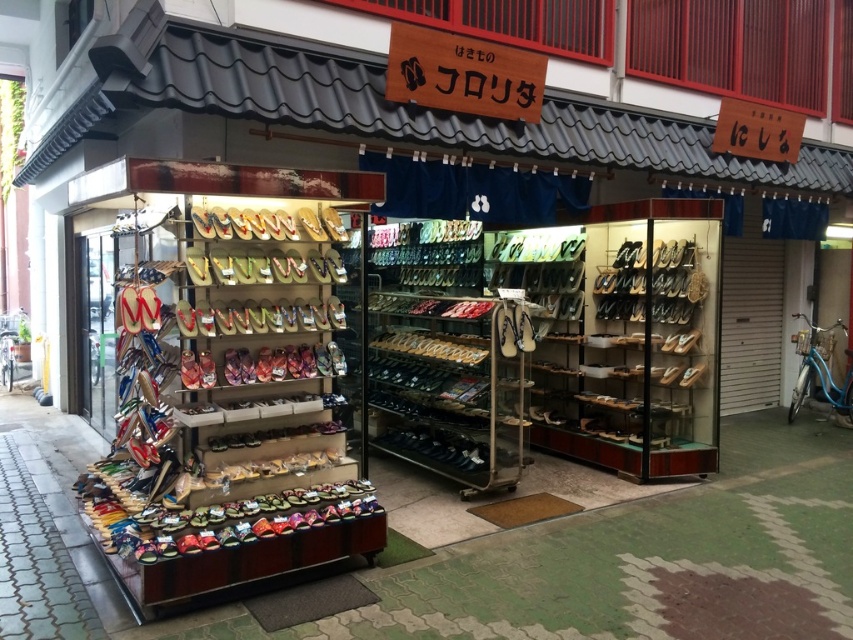
Question: Which point appears closest to the camera in this image?

Choices:
 (A) (271, 236)
 (B) (265, 312)

Answer: (A)

Question: Among these objects, which one is farthest from the camera?

Choices:
 (A) matte wooden sandals at center
 (B) shiny metallic sandals at center

Answer: (B)

Question: From the image, what is the correct spatial relationship of matte wooden sandals at center in relation to shiny metallic sandals at center?

Choices:
 (A) below
 (B) above

Answer: (B)

Question: Is matte wooden sandals at center further to camera compared to shiny metallic sandals at center?

Choices:
 (A) no
 (B) yes

Answer: (A)

Question: Can you confirm if matte wooden sandals at center is wider than shiny metallic sandals at center?

Choices:
 (A) yes
 (B) no

Answer: (B)